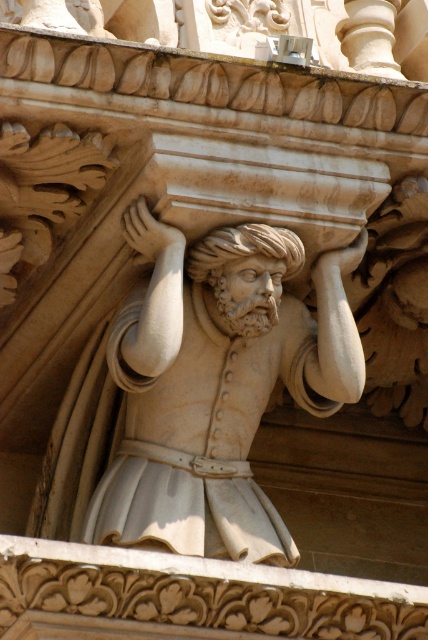
Describe the element at coordinates (216, 385) in the screenshot. This screenshot has height=640, width=428. I see `white marble statue at center` at that location.

Which is more to the right, white marble statue at center or white marble head at center?

Positioned to the right is white marble head at center.

Who is more distant from viewer, (311, 408) or (223, 244)?

The point (311, 408) is behind.

Locate an element on the screen. white marble statue at center is located at coordinates (216, 385).